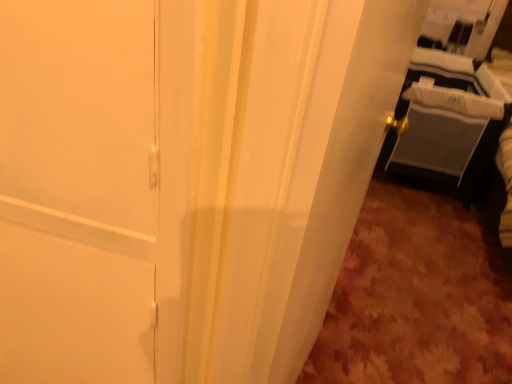
Where is `metallic gray cabinet at right`? This screenshot has width=512, height=384. metallic gray cabinet at right is located at coordinates (448, 120).

This screenshot has width=512, height=384. Describe the element at coordinates (448, 120) in the screenshot. I see `metallic gray cabinet at right` at that location.

Where is `metallic gray cabinet at right`? The image size is (512, 384). metallic gray cabinet at right is located at coordinates (448, 120).